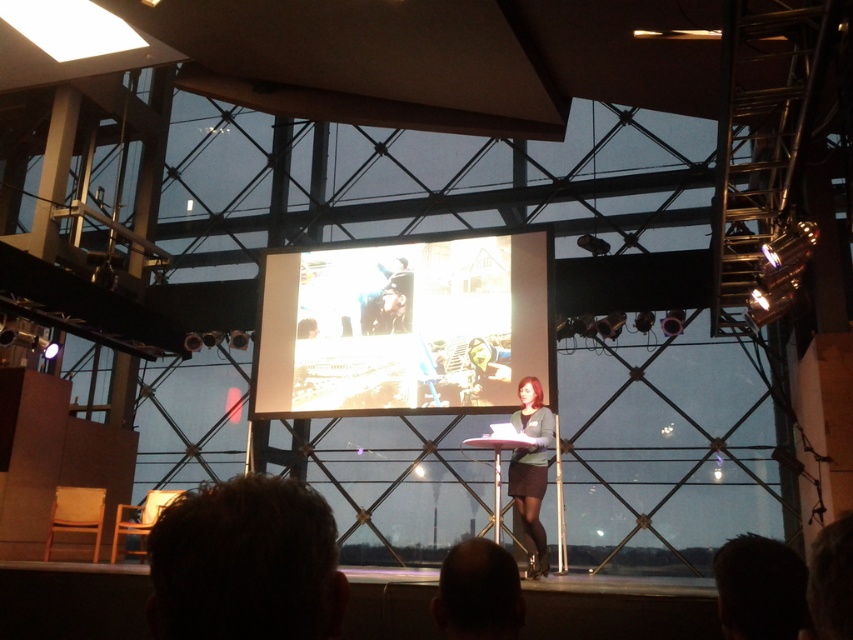
Question: Considering the real-world distances, which object is farthest from the white glossy screen at center?

Choices:
 (A) matte gray sweater at center
 (B) dark brown hair at lower center

Answer: (B)

Question: Does white glossy screen at center appear on the right side of matte gray sweater at center?

Choices:
 (A) yes
 (B) no

Answer: (B)

Question: Does dark brown hair at lower left have a smaller size compared to matte gray sweater at center?

Choices:
 (A) no
 (B) yes

Answer: (B)

Question: Where is dark brown hair at lower left located in relation to matte gray sweater at center in the image?

Choices:
 (A) below
 (B) above

Answer: (B)

Question: Which of the following is the farthest from the observer?

Choices:
 (A) dark brown hair at lower left
 (B) dark brown hair at lower center

Answer: (B)

Question: Based on their relative distances, which object is farther from the white glossy screen at center?

Choices:
 (A) dark brown hair at lower center
 (B) matte gray sweater at center

Answer: (A)